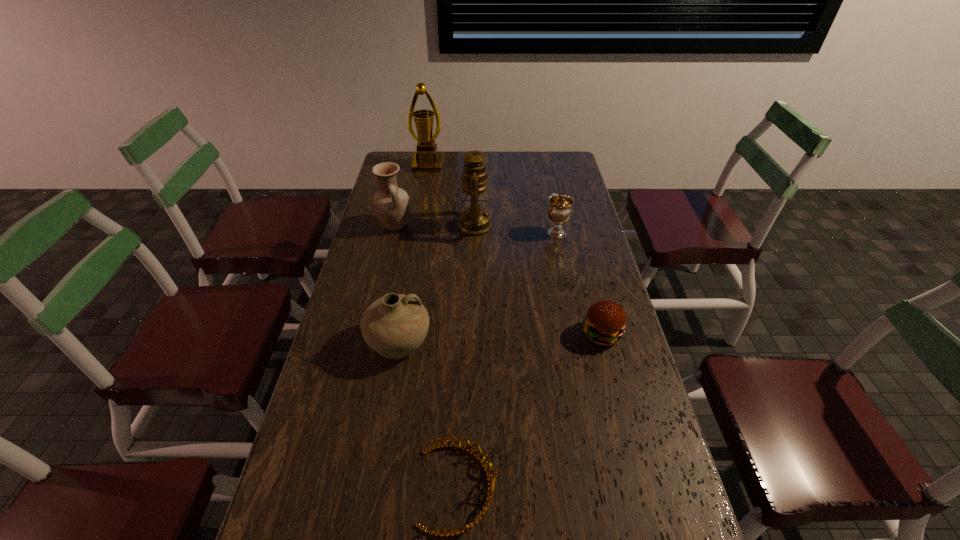
Identify the location of free space in the image that satisfies the following two spatial constraints: 1. on the front-facing side of the farthest object; 2. on the left side of the fifth tallest object. (417, 233).

I want to click on free space that satisfies the following two spatial constraints: 1. on the front side of the sixth shortest object; 2. on the left side of the fifth shortest object, so click(x=396, y=226).

Where is `vacant area that satisfies the following two spatial constraints: 1. on the front-facing side of the sixth tallest object; 2. on the right side of the tallest object`? vacant area that satisfies the following two spatial constraints: 1. on the front-facing side of the sixth tallest object; 2. on the right side of the tallest object is located at coordinates (398, 334).